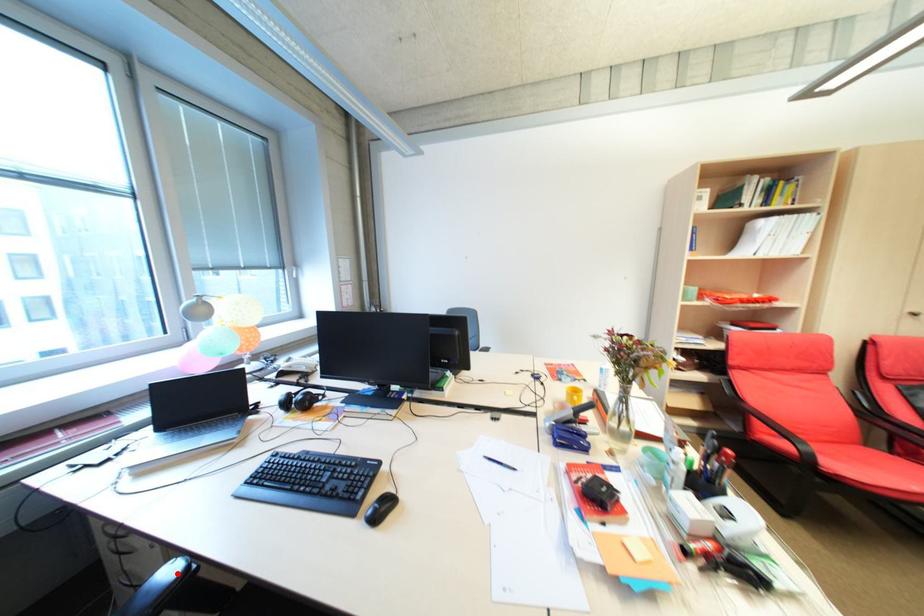
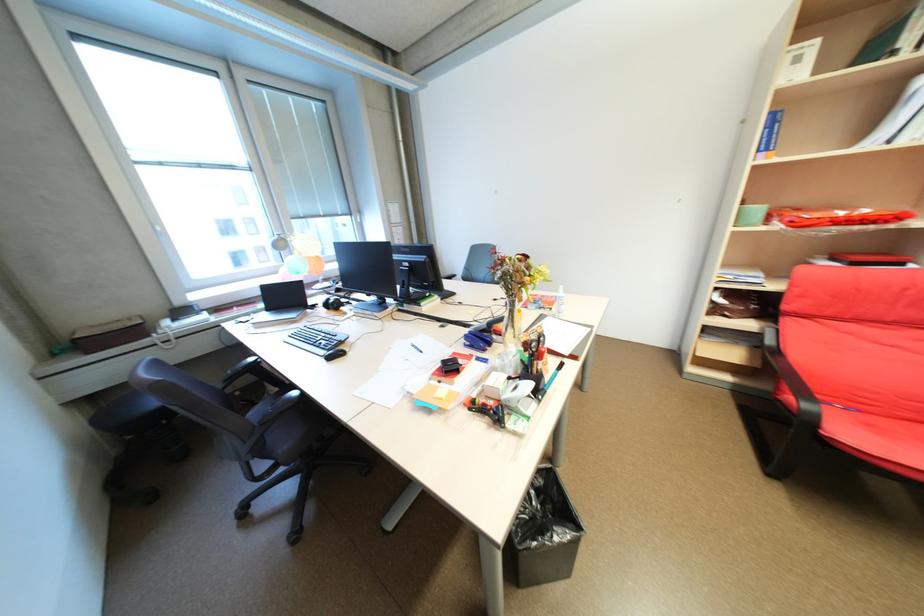
Question: I am providing you with two images of the same scene from different viewpoints. A red point is marked on the first image. Is the red point's position out of view in image 2?

Choices:
 (A) Yes
 (B) No

Answer: (A)